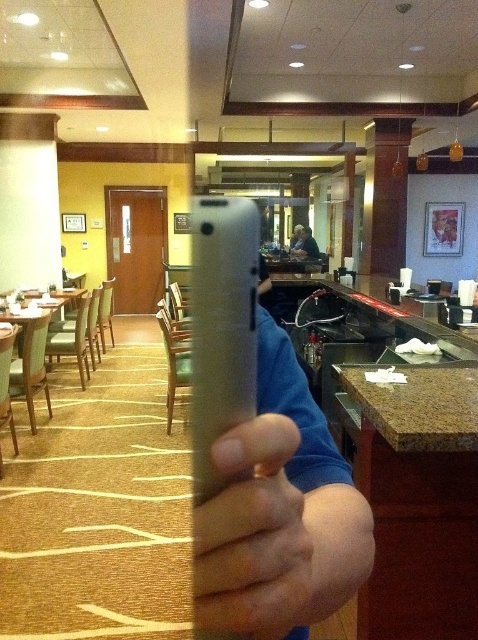
Looking at this image, you are standing in a restaurant and want to place a 12 inch wide decorative plate on the table. There is a point marked at coordinates point (230, 472) that you need to consider. Can you determine if the plate will fit without overlapping this point?

The point (230, 472) is 11.65 inches away from the viewer. Since the plate is 12 inches wide, it might overlap the point depending on placement. However, the exact position of the table and plate orientation must be considered for accurate placement.

You are standing in the restaurant and want to place your matte gray phone at center on a table. If the table is located at point coordinates of 0.839, 0.533, will the phone fit perfectly on it?

The matte gray phone at center is positioned exactly at point coordinates of (x=254, y=536), so it will fit perfectly on the table located there.

You are a photographer trying to capture a clear photo of the matte gray phone at center and the blue cotton shirt at center. Since the phone is smaller, will it be easier to fit both objects into the frame without cropping?

The matte gray phone at center has a smaller width than the blue cotton shirt at center, so it will be easier to fit both objects into the frame without cropping.